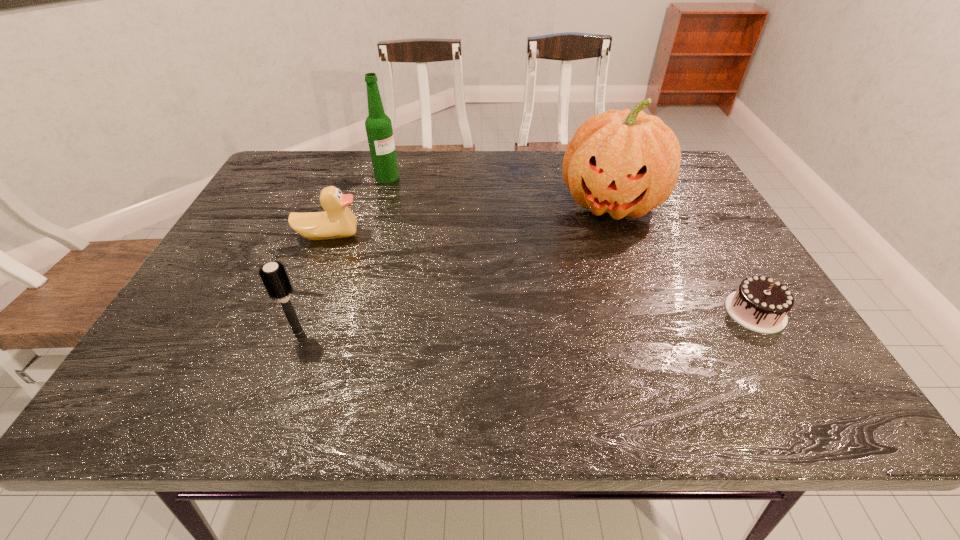
At what (x,y) coordinates should I click in order to perform the action: click on the third tallest object. Please return your answer as a coordinate pair (x, y). Image resolution: width=960 pixels, height=540 pixels. Looking at the image, I should click on (273, 275).

Identify the location of the shortest object. (761, 304).

Image resolution: width=960 pixels, height=540 pixels. I want to click on chocolate cake, so click(x=761, y=304).

Image resolution: width=960 pixels, height=540 pixels. Identify the location of the second object from right to left. (626, 163).

I want to click on the fourth tallest object, so click(337, 221).

You are a GUI agent. You are given a task and a screenshot of the screen. Output one action in this format:
    pyautogui.click(x=<x>, y=<y>)
    Task: Click on the beer bottle
    This screenshot has width=960, height=540.
    Given the screenshot: What is the action you would take?
    pyautogui.click(x=378, y=125)

You are a GUI agent. You are given a task and a screenshot of the screen. Output one action in this format:
    pyautogui.click(x=<x>, y=<y>)
    Task: Click on the vacant space located on the back of the third shortest object
    
    Given the screenshot: What is the action you would take?
    pyautogui.click(x=336, y=231)

Identify the location of vacant space located 0.100m on the left of the chocolate cake. (681, 312).

I want to click on vacant space positioned 0.110m on the carved face of the second object from right to left, so click(593, 261).

Image resolution: width=960 pixels, height=540 pixels. I want to click on vacant space located 0.250m on the carved face of the second object from right to left, so click(x=581, y=300).